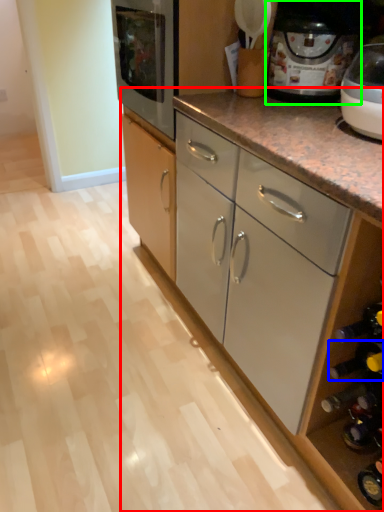
Question: Estimate the real-world distances between objects in this image. Which object is farther from cabinetry (highlighted by a red box), wine bottle (highlighted by a blue box) or home appliance (highlighted by a green box)?

Choices:
 (A) wine bottle
 (B) home appliance

Answer: (A)